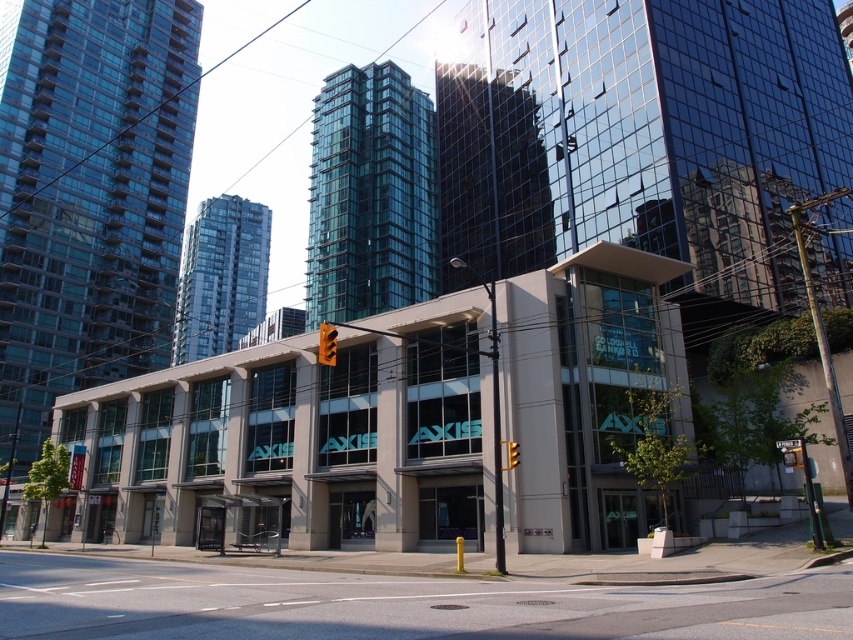
You are a delivery robot with a 3 feet wide package. You need to move from the concrete sidewalk at lower center to the yellow metallic traffic light at center. Is there enough space for your package to pass through the area between them?

The concrete sidewalk at lower center is 24.23 feet from the yellow metallic traffic light at center, so there is sufficient space for the 3 feet wide package to pass through the area between them.

You are a delivery person trying to navigate to the entrance of the building with the teal letters. You see the concrete sidewalk at lower center and the yellow metallic traffic light at center. Which object is closer to the building entrance?

The concrete sidewalk at lower center is positioned on the left side of the yellow metallic traffic light at center, so the concrete sidewalk at lower center is closer to the building entrance since it is to the left of the traffic light.